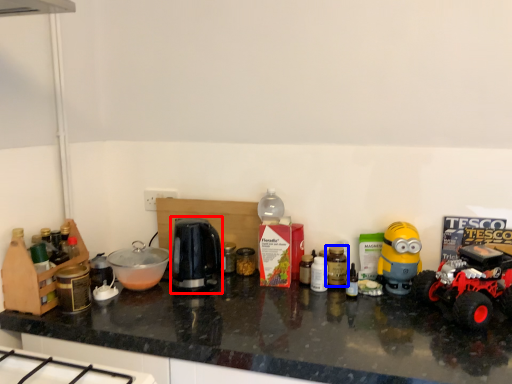
Question: Which object is further to the camera taking this photo, coffee machine (highlighted by a red box) or bottle (highlighted by a blue box)?

Choices:
 (A) coffee machine
 (B) bottle

Answer: (B)